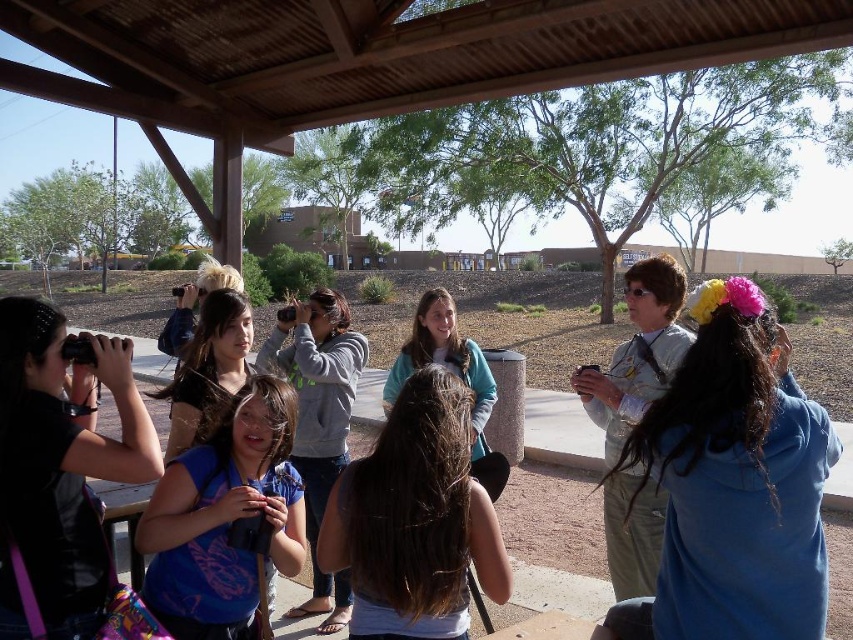
Which is more to the left, blue fleece jacket at right or brown hair at center?

From the viewer's perspective, brown hair at center appears more on the left side.

Does point (683, 532) lie behind point (393, 547)?

No, (683, 532) is closer to viewer.

Where is `blue fleece jacket at right`? This screenshot has height=640, width=853. blue fleece jacket at right is located at coordinates (733, 484).

Is blue fleece jacket at right to the left of teal sweater at center from the viewer's perspective?

No, blue fleece jacket at right is not to the left of teal sweater at center.

Who is taller, blue fleece jacket at right or teal sweater at center?

Standing taller between the two is blue fleece jacket at right.

Who is more forward, [703,540] or [381,400]?

Positioned in front is point [703,540].

Where is `blue fleece jacket at right`? blue fleece jacket at right is located at coordinates (733, 484).

Is brown hair at center wider than teal sweater at center?

Yes.

Can you confirm if brown hair at center is bigger than teal sweater at center?

Indeed, brown hair at center has a larger size compared to teal sweater at center.

Is point (370, 518) positioned before point (409, 349)?

Yes, point (370, 518) is closer to viewer.

This screenshot has height=640, width=853. I want to click on brown hair at center, so click(415, 518).